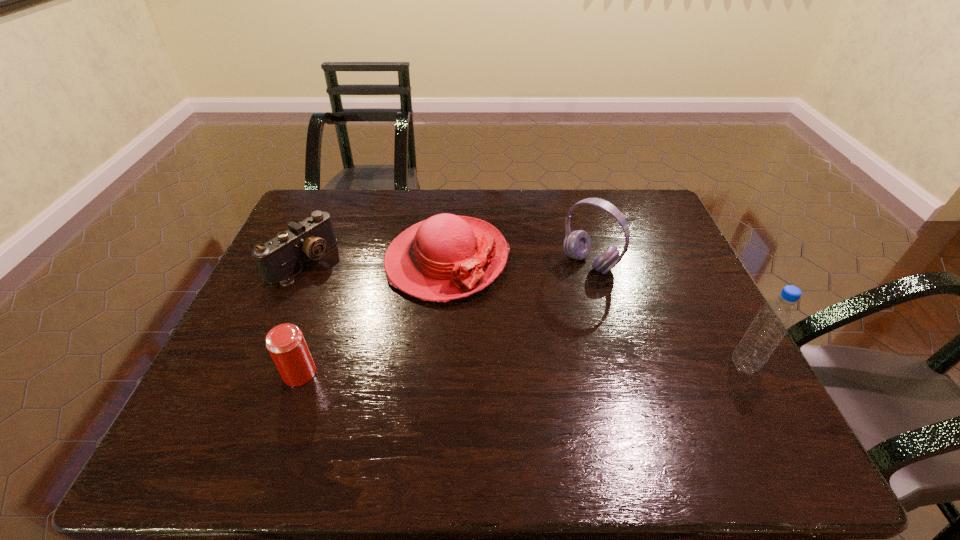
What are the coordinates of `empty space between the hat and the camera` in the screenshot? It's located at tap(374, 261).

This screenshot has height=540, width=960. Identify the location of vacant area that lies between the water bottle and the beer can. (522, 369).

Where is `vacant area that lies between the hat and the beer can`? The width and height of the screenshot is (960, 540). vacant area that lies between the hat and the beer can is located at coordinates (373, 317).

Where is `free space that is in between the hat and the headset`? Image resolution: width=960 pixels, height=540 pixels. free space that is in between the hat and the headset is located at coordinates (518, 262).

This screenshot has height=540, width=960. I want to click on blank region between the hat and the beer can, so pos(373,317).

Locate an element on the screen. The image size is (960, 540). vacant area that lies between the rightmost object and the camera is located at coordinates (523, 314).

Locate an element on the screen. free spot between the camera and the beer can is located at coordinates (301, 318).

This screenshot has height=540, width=960. What are the coordinates of `object that is the fourth nearest to the beer can` in the screenshot? It's located at (773, 320).

Where is `object that is the third closest to the beer can`? This screenshot has height=540, width=960. object that is the third closest to the beer can is located at coordinates (577, 244).

Identify the location of free space that satisfies the following two spatial constraints: 1. on the front side of the water bottle; 2. on the right side of the camera. This screenshot has height=540, width=960. (255, 366).